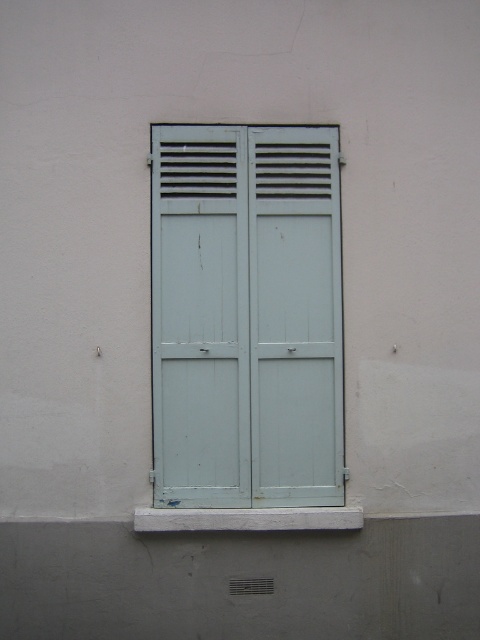
Question: Which is farther from the white concrete at lower center?

Choices:
 (A) light blue wood door at center
 (B) light blue wooden door at center

Answer: (B)

Question: Estimate the real-world distances between objects in this image. Which object is closer to the white concrete at lower center?

Choices:
 (A) light blue wood door at center
 (B) light blue wooden door at center
 (C) light blue wood shutters at center

Answer: (A)

Question: Is light blue wooden door at center in front of white concrete at lower center?

Choices:
 (A) yes
 (B) no

Answer: (B)

Question: Which point is closer to the camera taking this photo?

Choices:
 (A) (247, 467)
 (B) (158, 528)
 (C) (287, 422)
 (D) (216, 336)

Answer: (B)

Question: Can you confirm if light blue wood shutters at center is positioned above light blue wood door at center?

Choices:
 (A) no
 (B) yes

Answer: (B)

Question: Is light blue wood shutters at center behind light blue wood door at center?

Choices:
 (A) yes
 (B) no

Answer: (A)